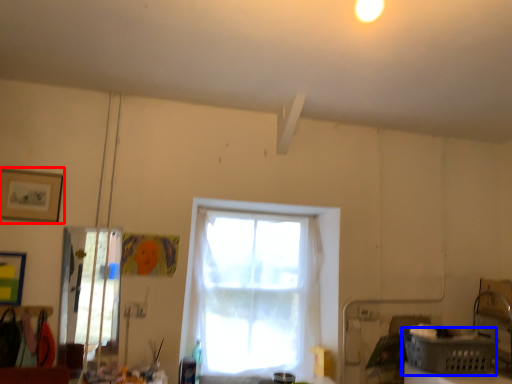
Question: Which object appears closest to the camera in this image, picture frame (highlighted by a red box) or basket (highlighted by a blue box)?

Choices:
 (A) picture frame
 (B) basket

Answer: (B)